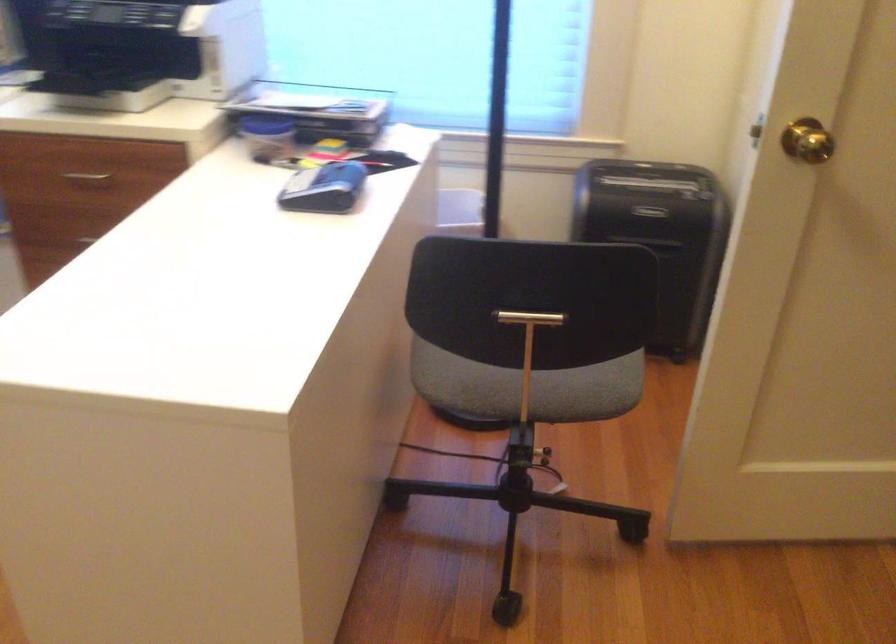
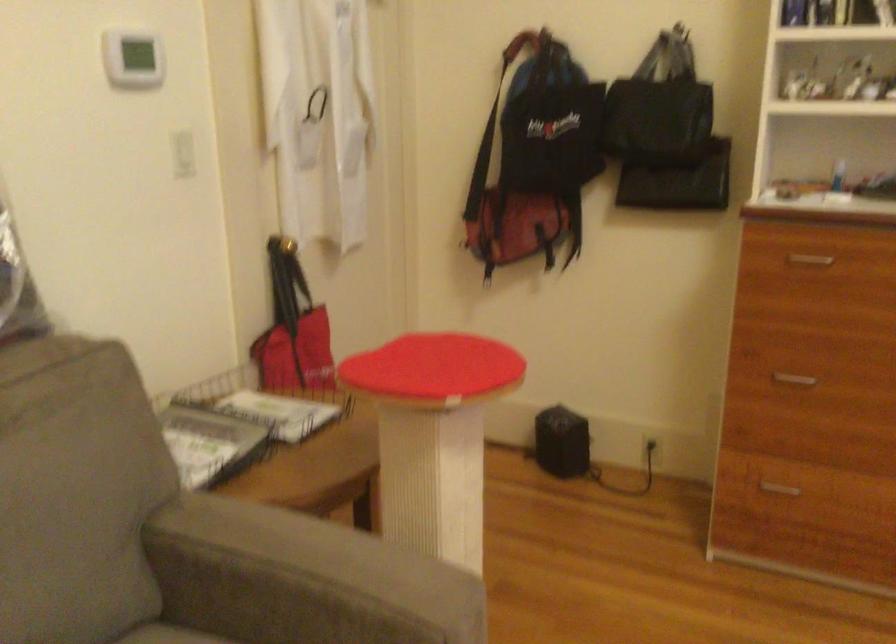
Based on the continuous images, in which direction is the camera rotating?

The camera's rotation is toward left-down.